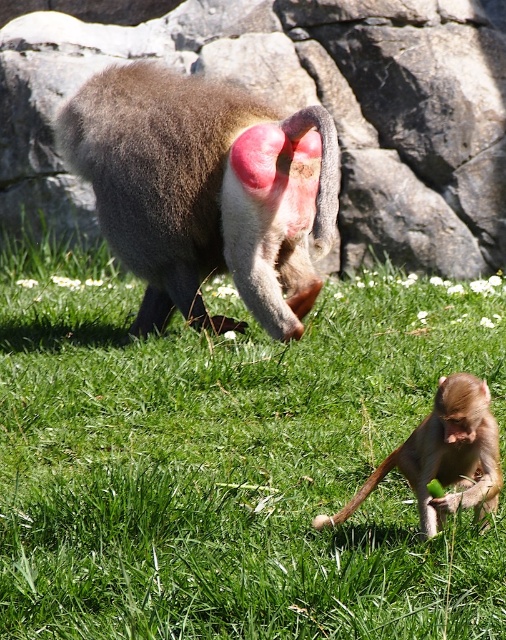
You are a photographer trying to capture both the brown furry monkey at center and the light brown fur monkey at lower right in a single shot. Which monkey should you focus on first to ensure both are in frame?

The brown furry monkey at center is positioned over the light brown fur monkey at lower right, so you should focus on the light brown fur monkey at lower right first to ensure both are in frame.

You are a photographer trying to capture a closeup shot of the green grass at center and the gray rock at upper center. Which object should you zoom in on to get a clearer image without moving your camera?

The gray rock at upper center is thicker than the green grass at center, so zooming in on the gray rock at upper center will provide a clearer image without moving the camera.